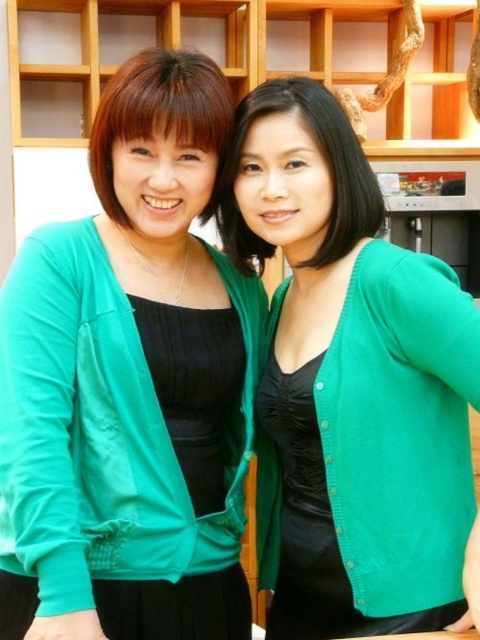
Is point (277, 100) farther from camera compared to point (331, 172)?

Yes.

What do you see at coordinates (350, 385) in the screenshot?
I see `green matte cardigan at center` at bounding box center [350, 385].

Identify the location of green matte cardigan at center. (350, 385).

Locate an element on the screen. This screenshot has height=640, width=480. green matte cardigan at center is located at coordinates (350, 385).

Which is in front, point (360, 547) or point (183, 76)?

Point (360, 547) is in front.

Looking at this image, who is higher up, green matte cardigan at center or matte black blouse at left?

matte black blouse at left

I want to click on green matte cardigan at center, so click(x=350, y=385).

Where is `green matte cardigan at center`? This screenshot has height=640, width=480. green matte cardigan at center is located at coordinates (350, 385).

Is matte green cardigan at left shorter than matte black blouse at left?

No.

Does matte green cardigan at left come in front of matte black blouse at left?

Yes, it is in front of matte black blouse at left.

Is point (45, 291) farther from camera compared to point (180, 51)?

No, (45, 291) is in front of (180, 51).

Identify the location of matte green cardigan at left. (131, 384).